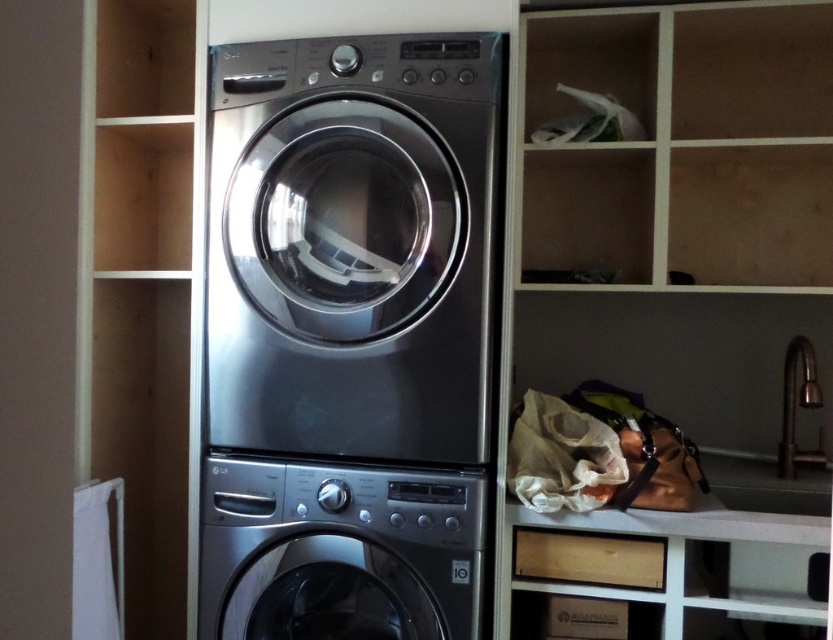
Question: Among these objects, which one is farthest from the camera?

Choices:
 (A) stainless steel washing machine at center
 (B) satin silver washing machine at center

Answer: (A)

Question: Does stainless steel washing machine at center have a greater width compared to satin silver washing machine at center?

Choices:
 (A) yes
 (B) no

Answer: (A)

Question: Which point is farther to the camera?

Choices:
 (A) (466, 593)
 (B) (238, 76)

Answer: (B)

Question: Does stainless steel washing machine at center appear under satin silver washing machine at center?

Choices:
 (A) no
 (B) yes

Answer: (A)

Question: Which of the following is the farthest from the observer?

Choices:
 (A) (228, 104)
 (B) (248, 600)

Answer: (A)

Question: Does stainless steel washing machine at center appear under satin silver washing machine at center?

Choices:
 (A) yes
 (B) no

Answer: (B)